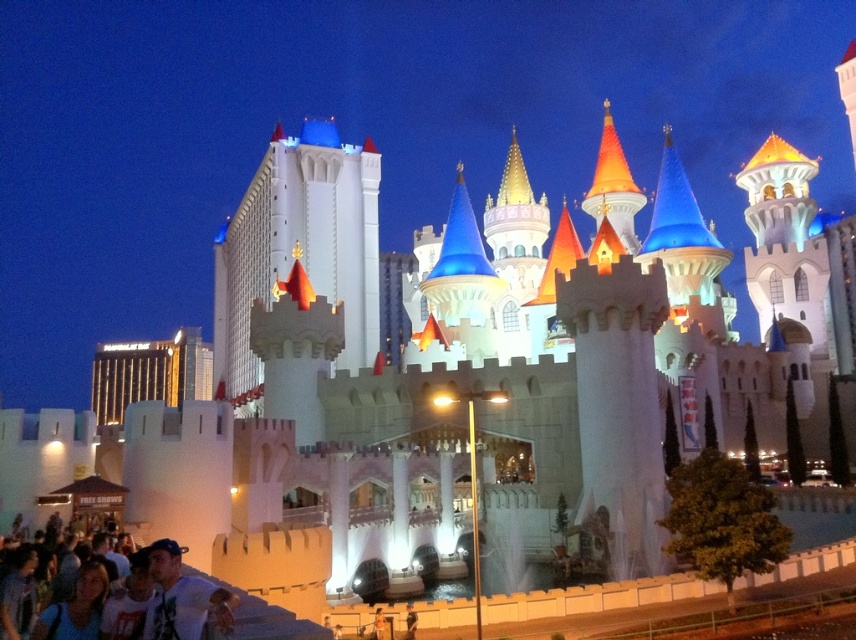
Question: Among these objects, which one is nearest to the camera?

Choices:
 (A) white t-shirt at lower left
 (B) white stone castle at center
 (C) orange-tinted stone tower at upper right

Answer: (A)

Question: Which object is the closest to the white t-shirt at lower left?

Choices:
 (A) blue fabric shirt at lower left
 (B) white stone castle at center
 (C) orange-tinted stone tower at upper right

Answer: (A)

Question: Does orange-tinted stone tower at upper right have a greater width compared to white t-shirt at lower left?

Choices:
 (A) no
 (B) yes

Answer: (B)

Question: Is white stone castle at center to the left of orange-tinted stone tower at upper right from the viewer's perspective?

Choices:
 (A) no
 (B) yes

Answer: (B)

Question: Based on their relative distances, which object is nearer to the orange-tinted stone tower at upper right?

Choices:
 (A) blue fabric shirt at lower left
 (B) white t-shirt at lower left
 (C) white stone castle at center

Answer: (C)

Question: Does white t-shirt at lower left appear on the right side of blue fabric shirt at lower left?

Choices:
 (A) no
 (B) yes

Answer: (B)